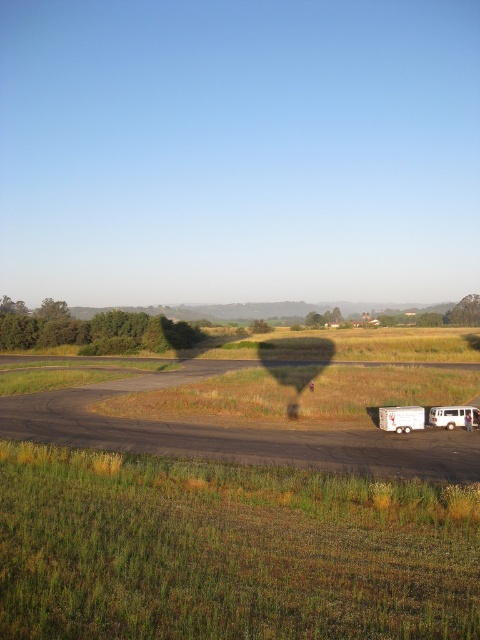
Based on the photo, you are a hiker who wants to cross the field. You have a map showing the green grassy field at center and the brown dirt track at center. Which path would be easier to walk on?

The brown dirt track at center would be easier to walk on since the green grassy field at center is much taller and might obstruct your path.

You are standing at the camera position looking at the open field. There are two points marked in the scene, point A at coordinates point (450, 544) and point B at coordinates point (434, 420). Which point is closer to you?

Point point (450, 544) is closer to the camera than point point (434, 420).

You are driving a delivery truck and need to turn left onto the brown dirt track at center from the road where you are currently driving. There is a white matte trailer truck at lower right parked nearby. Can you safely make this left turn without hitting the trailer?

The brown dirt track at center is positioned on the left side of the white matte trailer truck at lower right, so yes, you can safely turn left onto the brown dirt track at center without hitting the trailer as it is already parked to the right of the track.